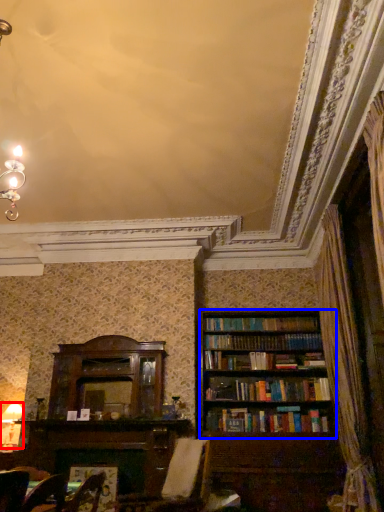
Question: Among these objects, which one is nearest to the camera, lamp (highlighted by a red box) or bookcase (highlighted by a blue box)?

Choices:
 (A) lamp
 (B) bookcase

Answer: (B)